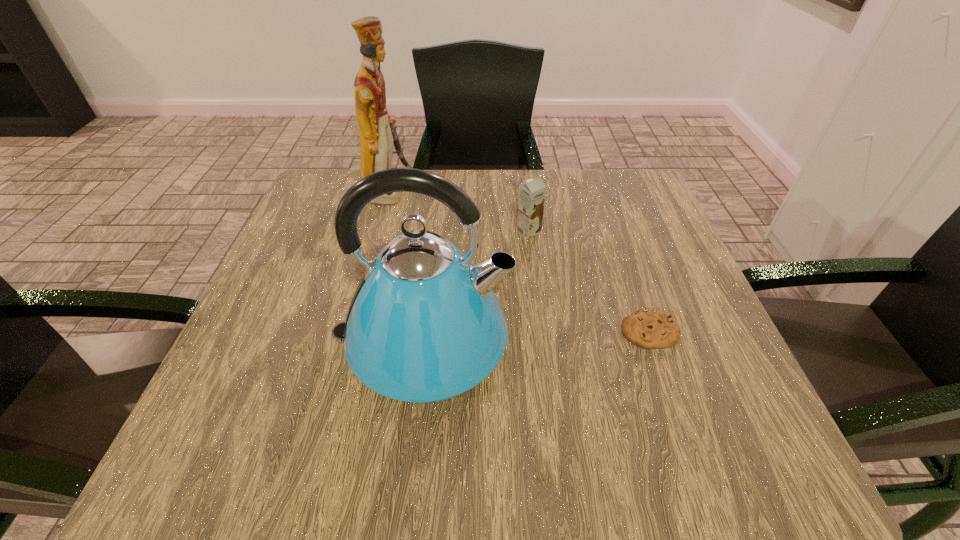
You are a GUI agent. You are given a task and a screenshot of the screen. Output one action in this format:
    pyautogui.click(x=<x>, y=<y>)
    Task: Click on the blank space that satisfies the following two spatial constraints: 1. on the front-facing side of the nutcracker; 2. on the right side of the rightmost object
    The height and width of the screenshot is (540, 960).
    Given the screenshot: What is the action you would take?
    pyautogui.click(x=351, y=331)

Locate an element on the screen. This screenshot has width=960, height=540. free space that satisfies the following two spatial constraints: 1. on the front side of the second farthest object; 2. on the right side of the cookie is located at coordinates (541, 331).

Find the location of a particular element. free space that satisfies the following two spatial constraints: 1. on the front-facing side of the farthest object; 2. on the left side of the cookie is located at coordinates (351, 331).

Image resolution: width=960 pixels, height=540 pixels. What are the coordinates of `vacant space that satisfies the following two spatial constraints: 1. on the front-facing side of the farthest object; 2. on the right side of the chocolate milk` in the screenshot? It's located at (378, 231).

The width and height of the screenshot is (960, 540). I want to click on vacant space that satisfies the following two spatial constraints: 1. on the front-facing side of the farthest object; 2. on the left side of the cookie, so click(351, 331).